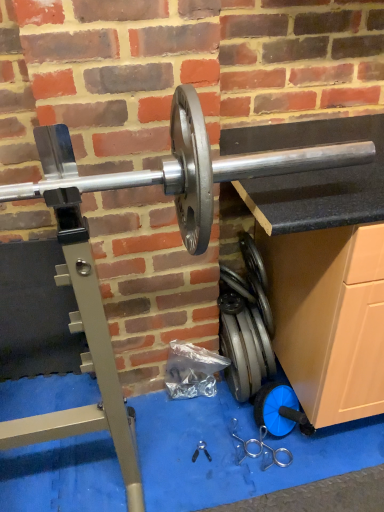
What do you see at coordinates (263, 451) in the screenshot? I see `silver metallic weight at lower center, acting as the 1th tool starting from the right` at bounding box center [263, 451].

Where is `black plastic pliers at center, placed as the first tool when sorted from left to right`? This screenshot has width=384, height=512. black plastic pliers at center, placed as the first tool when sorted from left to right is located at coordinates (202, 450).

Could you tell me if black plastic pliers at center, which is the 2th tool from right to left, is turned towards silver metallic weight at lower center, the second tool from the left?

No, black plastic pliers at center, which is the 2th tool from right to left, is not facing towards silver metallic weight at lower center, the second tool from the left.

Is black plastic pliers at center, which is the 2th tool from right to left, bigger than silver metallic weight at lower center, acting as the 1th tool starting from the right?

No.

Is silver metallic weight at lower center, acting as the 1th tool starting from the right, a part of black plastic pliers at center, which is the 2th tool from right to left?

No, black plastic pliers at center, which is the 2th tool from right to left, does not contain silver metallic weight at lower center, acting as the 1th tool starting from the right.

From a real-world perspective, who is located lower, black plastic pliers at center, which is the 2th tool from right to left, or silver metallic weight at lower center, the second tool from the left?

black plastic pliers at center, which is the 2th tool from right to left, is physically lower.

Is the depth of black plastic pliers at center, placed as the first tool when sorted from left to right, less than that of silver metallic barbell at center?

No, black plastic pliers at center, placed as the first tool when sorted from left to right, is further to the viewer.

From the picture: From a real-world perspective, which is physically above, black plastic pliers at center, which is the 2th tool from right to left, or silver metallic barbell at center?

silver metallic barbell at center.

Is black plastic pliers at center, which is the 2th tool from right to left, shorter than silver metallic barbell at center?

Yes.

Considering the positions of objects silver metallic barbell at center and silver metallic weight at lower center, acting as the 1th tool starting from the right, in the image provided, who is more to the left, silver metallic barbell at center or silver metallic weight at lower center, acting as the 1th tool starting from the right,?

silver metallic barbell at center is more to the left.

Choose the correct answer: Is silver metallic barbell at center inside silver metallic weight at lower center, acting as the 1th tool starting from the right, or outside it?

silver metallic barbell at center cannot be found inside silver metallic weight at lower center, acting as the 1th tool starting from the right.

Does point (238, 176) appear closer or farther from the camera than point (277, 460)?

Clearly, point (238, 176) is closer to the camera than point (277, 460).

Which object is closer to the camera taking this photo, silver metallic barbell at center or silver metallic weight at lower center, acting as the 1th tool starting from the right?

silver metallic barbell at center.

Is black plastic pliers at center, placed as the first tool when sorted from left to right, at the back of silver metallic weight at lower center, the second tool from the left?

No, silver metallic weight at lower center, the second tool from the left, is not facing away from black plastic pliers at center, placed as the first tool when sorted from left to right.

Which of these two, silver metallic weight at lower center, the second tool from the left, or black plastic pliers at center, which is the 2th tool from right to left, stands taller?

Standing taller between the two is silver metallic weight at lower center, the second tool from the left.

Does silver metallic weight at lower center, acting as the 1th tool starting from the right, appear on the left side of black plastic pliers at center, placed as the first tool when sorted from left to right?

No.

Which of these two, silver metallic weight at lower center, acting as the 1th tool starting from the right, or black plastic pliers at center, which is the 2th tool from right to left, is smaller?

Smaller between the two is black plastic pliers at center, which is the 2th tool from right to left.

Considering the positions of points (54, 140) and (195, 457), is point (54, 140) farther from camera compared to point (195, 457)?

No.

Is silver metallic barbell at center facing towards black plastic pliers at center, which is the 2th tool from right to left?

No, silver metallic barbell at center is not facing towards black plastic pliers at center, which is the 2th tool from right to left.

From a real-world perspective, is silver metallic barbell at center positioned above or below black plastic pliers at center, placed as the first tool when sorted from left to right?

From a real-world perspective, silver metallic barbell at center is physically above black plastic pliers at center, placed as the first tool when sorted from left to right.

Between silver metallic weight at lower center, acting as the 1th tool starting from the right, and silver metallic barbell at center, which one has more height?

silver metallic barbell at center.

Looking at this image, which object is positioned more to the right, silver metallic weight at lower center, acting as the 1th tool starting from the right, or silver metallic barbell at center?

From the viewer's perspective, silver metallic weight at lower center, acting as the 1th tool starting from the right, appears more on the right side.

Which is in front, point (275, 455) or point (292, 156)?

The point (292, 156) is in front.

From the image's perspective, who appears lower, silver metallic weight at lower center, the second tool from the left, or silver metallic barbell at center?

silver metallic weight at lower center, the second tool from the left, appears lower in the image.

Find the location of `tool above the black plastic pliers at center, which is the 2th tool from right to left (from the image's perspective)`. tool above the black plastic pliers at center, which is the 2th tool from right to left (from the image's perspective) is located at coordinates (263, 451).

Starting from the silver metallic barbell at center, which tool is the 1st one to the right? Please provide its 2D coordinates.

[(202, 450)]

Based on the photo, considering their positions, is silver metallic barbell at center positioned further to silver metallic weight at lower center, acting as the 1th tool starting from the right, than black plastic pliers at center, which is the 2th tool from right to left?

Based on the image, silver metallic barbell at center appears to be further to silver metallic weight at lower center, acting as the 1th tool starting from the right.

Which object lies nearer to the anchor point silver metallic weight at lower center, the second tool from the left, black plastic pliers at center, which is the 2th tool from right to left, or silver metallic barbell at center?

Based on the image, black plastic pliers at center, which is the 2th tool from right to left, appears to be nearer to silver metallic weight at lower center, the second tool from the left.

Which object lies nearer to the anchor point silver metallic barbell at center, silver metallic weight at lower center, the second tool from the left, or black plastic pliers at center, which is the 2th tool from right to left?

Based on the image, silver metallic weight at lower center, the second tool from the left, appears to be nearer to silver metallic barbell at center.

From the picture: When comparing their distances from silver metallic barbell at center, does black plastic pliers at center, which is the 2th tool from right to left, or silver metallic weight at lower center, the second tool from the left, seem further?

Among the two, black plastic pliers at center, which is the 2th tool from right to left, is located further to silver metallic barbell at center.

Considering their positions, is silver metallic weight at lower center, acting as the 1th tool starting from the right, positioned further to black plastic pliers at center, which is the 2th tool from right to left, than silver metallic barbell at center?

Among the two, silver metallic barbell at center is located further to black plastic pliers at center, which is the 2th tool from right to left.

Looking at the image, which one is located further to black plastic pliers at center, which is the 2th tool from right to left, silver metallic barbell at center or silver metallic weight at lower center, the second tool from the left?

The object further to black plastic pliers at center, which is the 2th tool from right to left, is silver metallic barbell at center.

You are a GUI agent. You are given a task and a screenshot of the screen. Output one action in this format:
    pyautogui.click(x=<x>, y=<y>)
    Task: Click on the tool positioned between silver metallic barbell at center and black plastic pliers at center, which is the 2th tool from right to left, from near to far
    
    Given the screenshot: What is the action you would take?
    pyautogui.click(x=263, y=451)